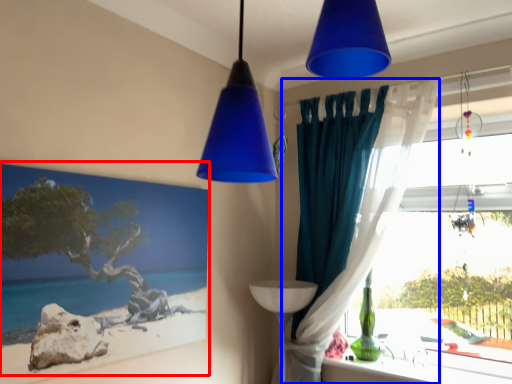
Question: Which object is closer to the camera taking this photo, picture frame (highlighted by a red box) or curtain (highlighted by a blue box)?

Choices:
 (A) picture frame
 (B) curtain

Answer: (A)